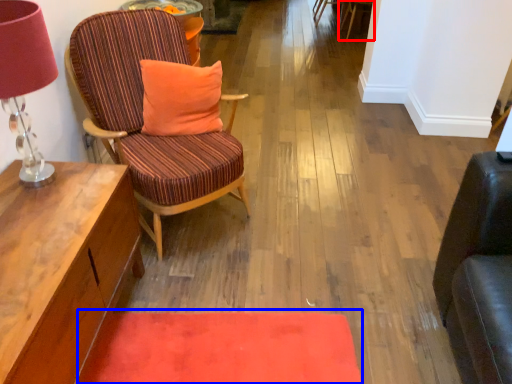
Question: Which object appears closest to the camera in this image, chair (highlighted by a red box) or mat (highlighted by a blue box)?

Choices:
 (A) chair
 (B) mat

Answer: (B)